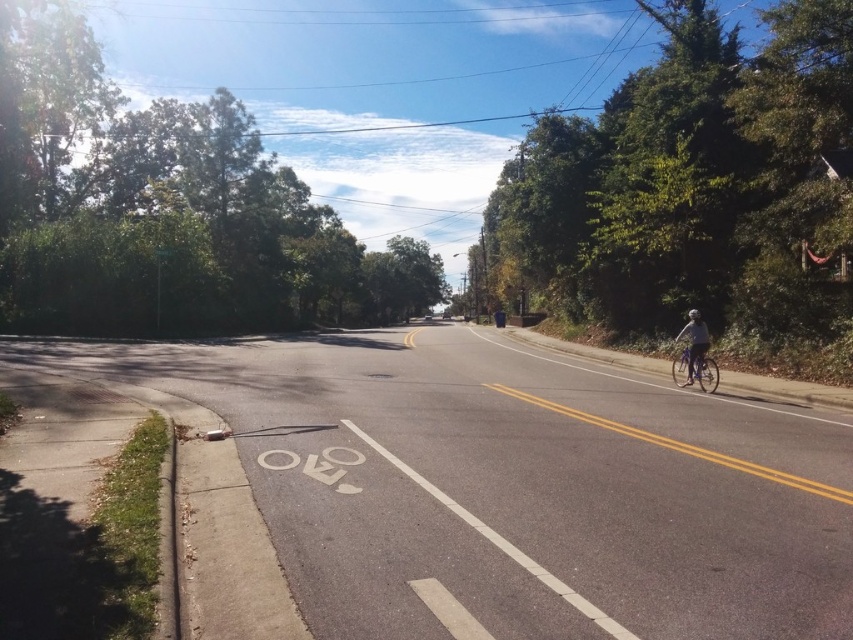
Question: Based on their relative distances, which object is farther from the metallic silver bicycle at right?

Choices:
 (A) blue metallic bicycle at right
 (B) black matte bicycle helmet at right
 (C) gray fabric helmet at right

Answer: (B)

Question: Does metallic silver bicycle at right come in front of gray fabric helmet at right?

Choices:
 (A) yes
 (B) no

Answer: (B)

Question: Which of these objects is positioned farthest from the black matte bicycle helmet at right?

Choices:
 (A) white painted bike lane at center
 (B) blue metallic bicycle at right

Answer: (A)

Question: Can you confirm if blue metallic bicycle at right is positioned to the right of black matte bicycle helmet at right?

Choices:
 (A) no
 (B) yes

Answer: (A)

Question: Which object is farther from the camera taking this photo?

Choices:
 (A) blue metallic bicycle at right
 (B) black matte bicycle helmet at right

Answer: (B)

Question: Is white painted bike lane at center below black matte bicycle helmet at right?

Choices:
 (A) no
 (B) yes

Answer: (B)